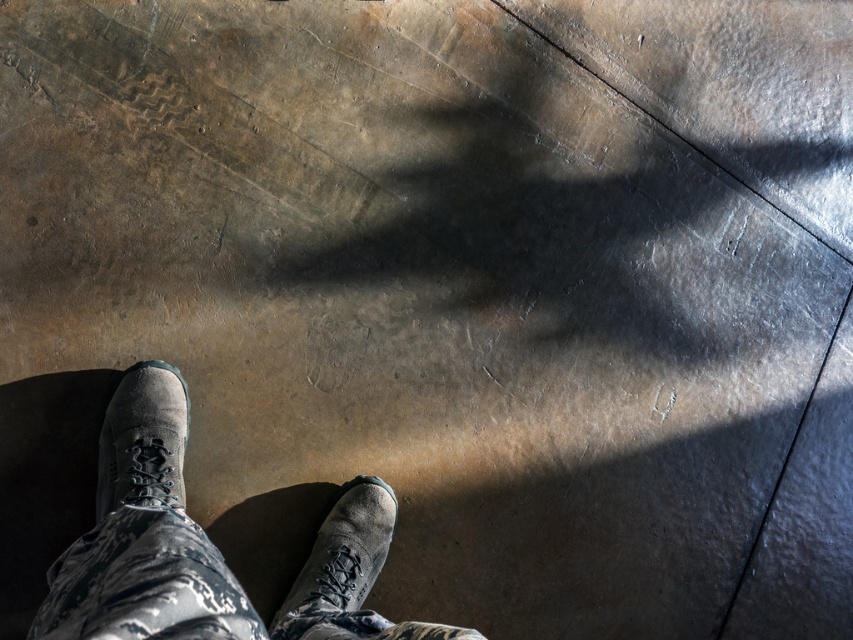
You are standing at the point marked as point (361, 529) on the floor. A friend is standing 1.58 meters away from you. Where is your friend located relative to you?

The friend is standing 1.58 meters away from point (361, 529), which is the location of the viewer in this scenario.